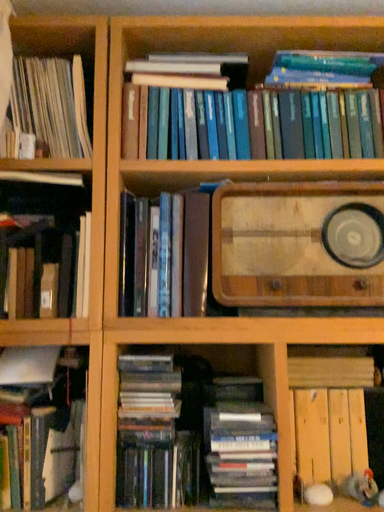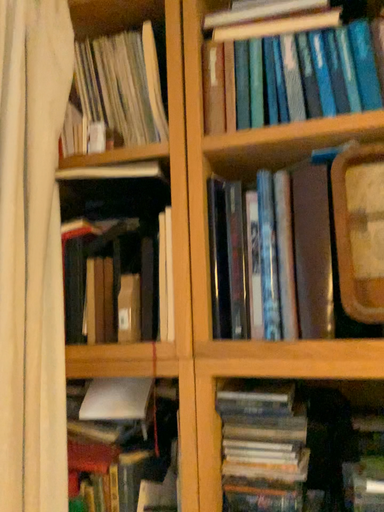
Question: How did the camera likely rotate when shooting the video?

Choices:
 (A) rotated left
 (B) rotated right

Answer: (A)